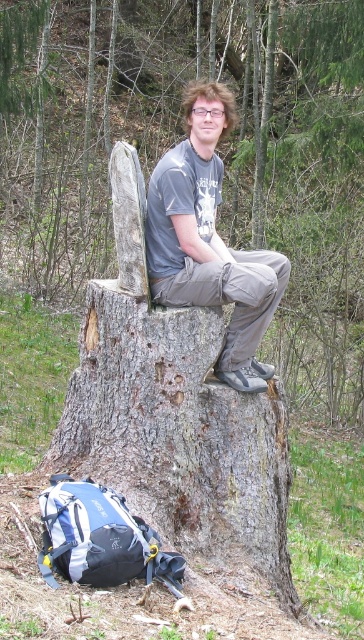
You are a photographer trying to capture a portrait of the person in the image. You notice the gray rough bark tree trunk at center and the matte gray shirt at center. Which object should you avoid placing in the foreground to ensure the person is clearly visible?

The gray rough bark tree trunk at center is in front of the matte gray shirt at center. To ensure the person is clearly visible, you should avoid placing the gray rough bark tree trunk at center in the foreground as it is blocking the view of the matte gray shirt at center.

You are trying to determine which object is taller between the smooth gray tree stump at center and the gray rough bark tree trunk at center. Based on the scene, which one is taller?

The smooth gray tree stump at center is taller than the gray rough bark tree trunk at center according to the description.

You are a hiker who wants to sit on the smooth gray tree stump at center. There is a gray rough bark tree trunk at center behind it. Which object should you sit on to be closer to the back of the area?

You should sit on the smooth gray tree stump at center because the gray rough bark tree trunk at center is behind it, making the stump closer to the back of the area.